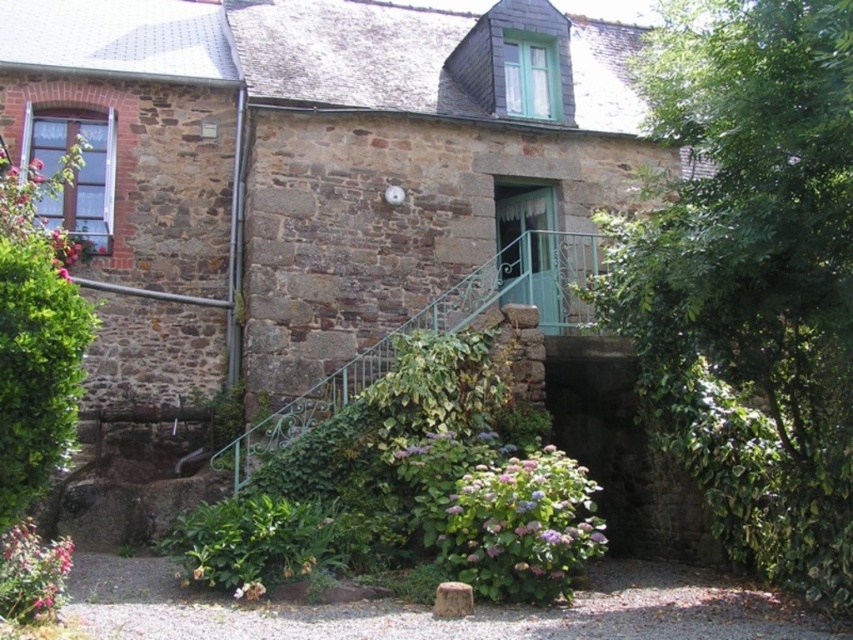
This screenshot has width=853, height=640. Describe the element at coordinates (251, 540) in the screenshot. I see `green leafy bush at lower center` at that location.

Is green leafy bush at lower center above purple matte flower at lower center?

Yes.

Describe the element at coordinates (251, 540) in the screenshot. The image size is (853, 640). I see `green leafy bush at lower center` at that location.

The width and height of the screenshot is (853, 640). What are the coordinates of `green leafy bush at lower center` in the screenshot? It's located at (251, 540).

Between point (590, 516) and point (193, 518), which one is positioned in front?

Positioned in front is point (193, 518).

Who is lower down, purple matte hydrangea at lower center or green leafy bush at lower center?

Positioned lower is green leafy bush at lower center.

Which is behind, point (474, 531) or point (300, 512)?

Positioned behind is point (300, 512).

Identify the location of purple matte hydrangea at lower center. (521, 522).

Which of these two, green leafy tree at center or green leafy bush at lower center, stands taller?

Standing taller between the two is green leafy tree at center.

Which is more to the left, green leafy tree at center or green leafy bush at lower center?

green leafy bush at lower center

Does point (850, 1) come in front of point (329, 509)?

Yes, it is.

At what (x,y) coordinates should I click in order to perform the action: click on green leafy tree at center. Please return your answer as a coordinate pair (x, y). Image resolution: width=853 pixels, height=640 pixels. Looking at the image, I should click on (755, 259).